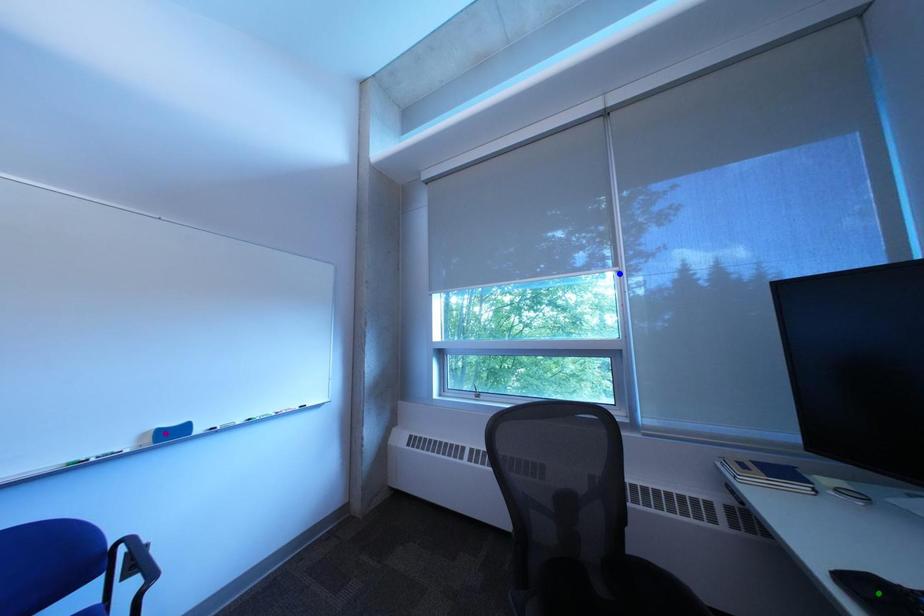
Order these from nearest to farthest:
A) green point
B) blue point
C) purple point

blue point → purple point → green point